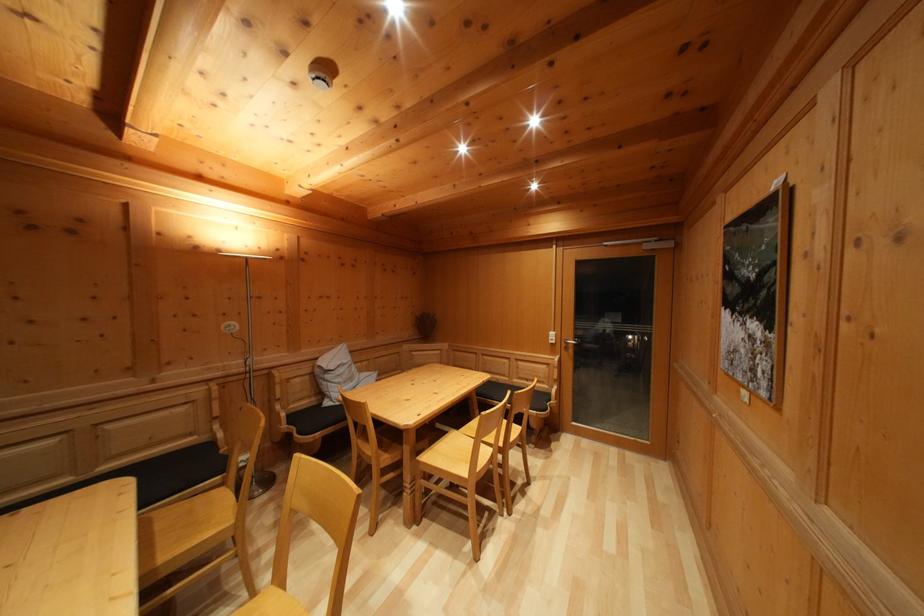
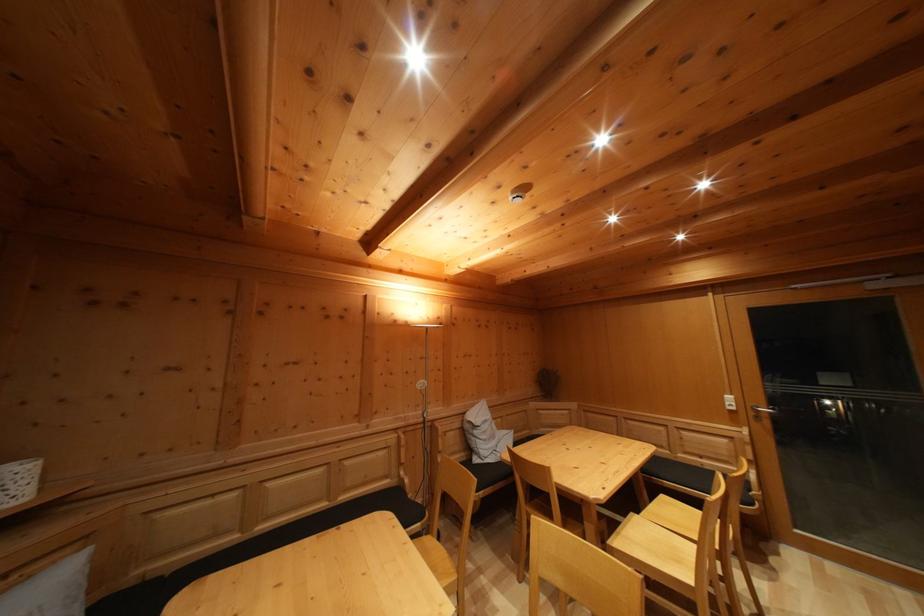
What movement of the cameraman would produce the second image?

The movement direction of the cameraman is left, backward.